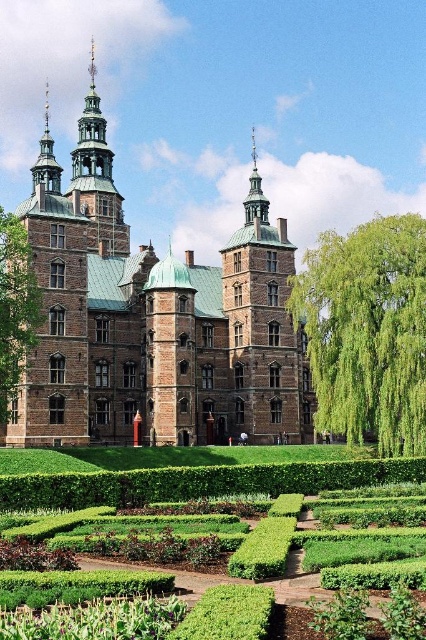
You are a landscape architect designing a new garden layout. You need to place a large statue that requires a space larger than the green hedge at lower center. Can the green copper tower at upper center accommodate this statue?

The green hedge at lower center occupies less space than the green copper tower at upper center. Therefore, the green copper tower at upper center has enough space to accommodate the statue as it occupies more space than the green hedge at lower center.

You are a landscape architect planning to add a new sculpture to the garden. The sculpture requires a base that is taller than the green leafy hedge at right but shorter than the green copper tower at upper center. Can you place the sculpture between these two objects?

The green leafy hedge at right is shorter than the green copper tower at upper center. Therefore, the sculpture can be placed between them as long as its base height is between the two.

You are standing in front of the historic building and want to determine the relative positions of two points in the garden. Which point is closer to you, point (170, 476) or point (120, 252)?

Point (170, 476) is closer to the viewer than point (120, 252).